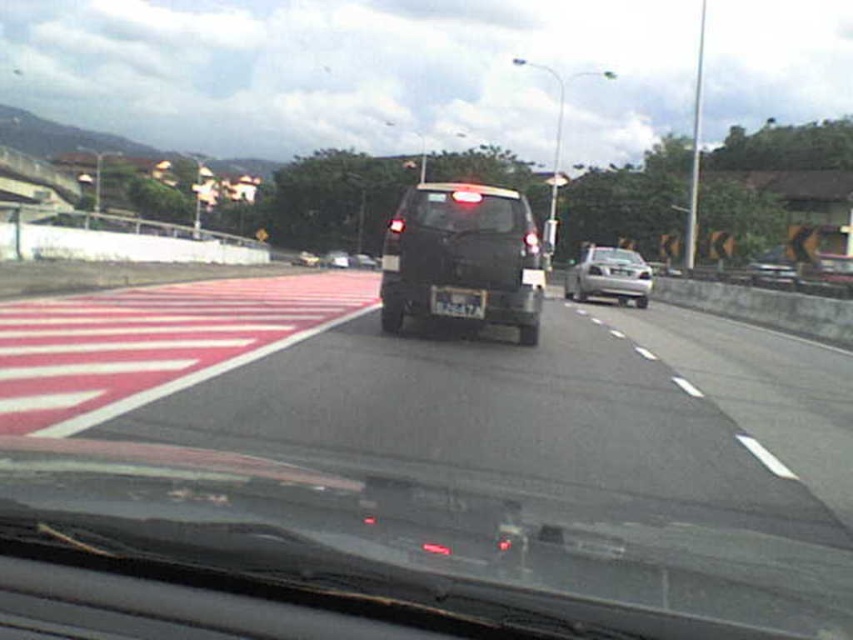
You are a driver in a car and you see the point at coordinate (462, 259) in your windshield. What does this point correspond to?

The point at coordinate (462, 259) corresponds to the matte black suv at center.

You are a passenger in a car and looking out the window. You see a black matte windshield at center and a silver metallic sedan at center. Which object appears taller from your viewpoint?

The silver metallic sedan at center appears taller because the black matte windshield at center has a lesser height compared to it.